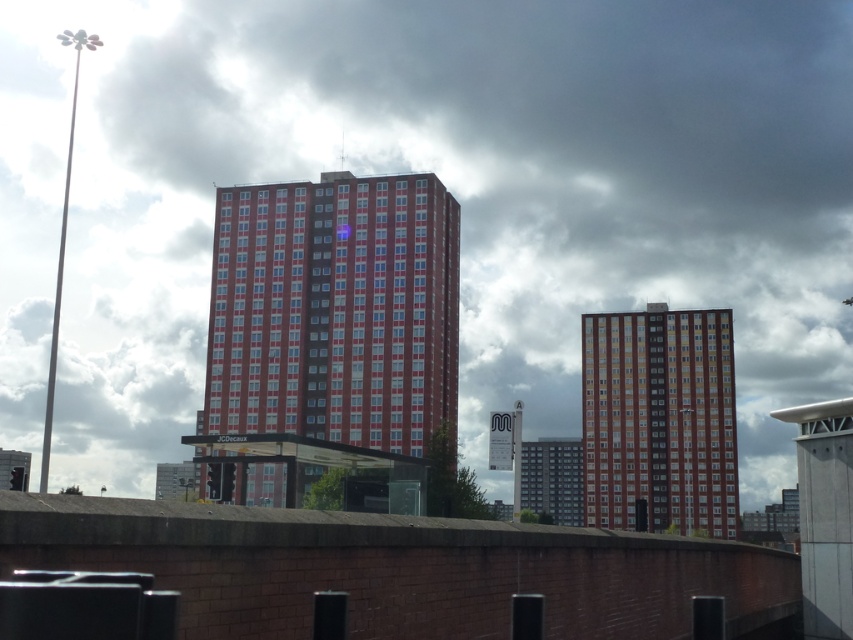
Question: Is red brick building at center positioned behind brick textured building at center?

Choices:
 (A) no
 (B) yes

Answer: (B)

Question: Among these points, which one is farthest from the camera?

Choices:
 (A) (590, 413)
 (B) (328, 387)

Answer: (A)

Question: Is red brick building at center in front of brick textured building at center?

Choices:
 (A) yes
 (B) no

Answer: (B)

Question: Which point is farther to the camera?

Choices:
 (A) brick textured building at center
 (B) red brick building at center

Answer: (B)

Question: Does red brick building at center lie behind brick textured building at center?

Choices:
 (A) yes
 (B) no

Answer: (A)